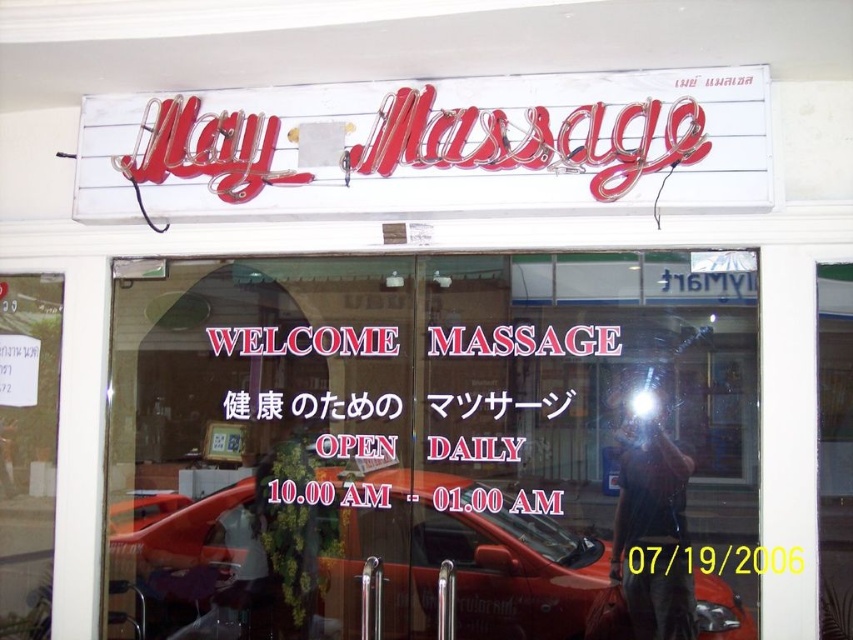
Question: Which point is closer to the camera?

Choices:
 (A) shiny red car at center
 (B) neon red sign at upper center
 (C) transparent glass door at center

Answer: (B)

Question: Is neon red sign at upper center further to the viewer compared to shiny red car at center?

Choices:
 (A) yes
 (B) no

Answer: (B)

Question: Which point is closer to the camera?

Choices:
 (A) (454, 548)
 (B) (724, 97)
 (C) (701, 476)

Answer: (B)

Question: Among these objects, which one is farthest from the camera?

Choices:
 (A) neon red sign at upper center
 (B) transparent glass door at center

Answer: (B)

Question: Does transparent glass door at center have a smaller size compared to neon red sign at upper center?

Choices:
 (A) yes
 (B) no

Answer: (B)

Question: Does transparent glass door at center appear over shiny red car at center?

Choices:
 (A) yes
 (B) no

Answer: (A)